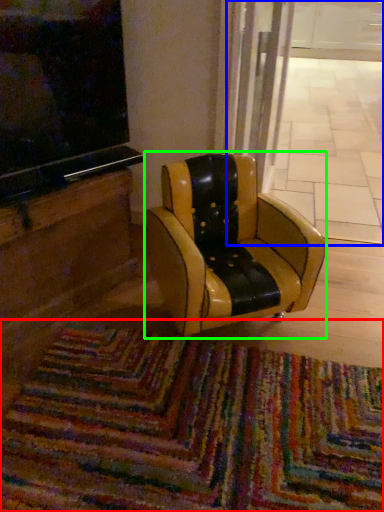
Question: Based on their relative distances, which object is nearer to mat (highlighted by a red box)? Choose from shop window (highlighted by a blue box) and chair (highlighted by a green box).

Choices:
 (A) shop window
 (B) chair

Answer: (B)